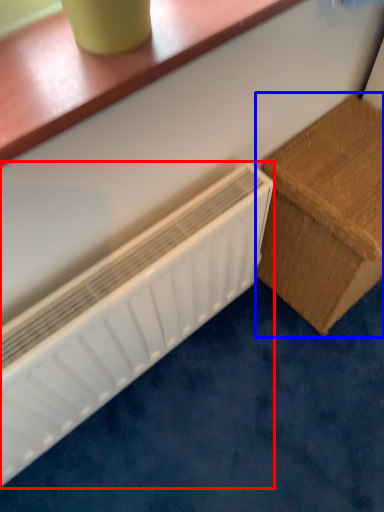
Question: Which object is closer to the camera taking this photo, radiator (highlighted by a red box) or furniture (highlighted by a blue box)?

Choices:
 (A) radiator
 (B) furniture

Answer: (A)